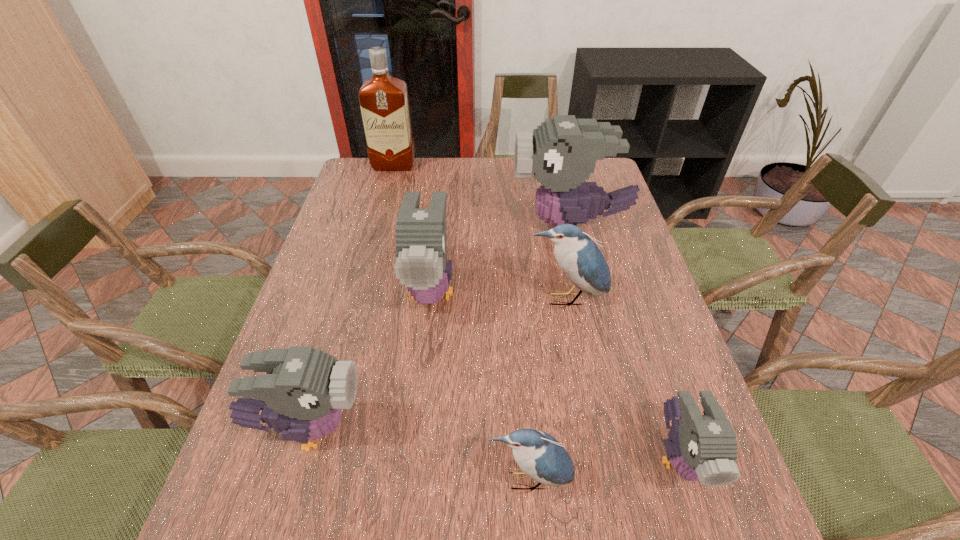
Identify the location of the smallest gray bird. The width and height of the screenshot is (960, 540). (703, 448).

At what (x,y) coordinates should I click in order to perform the action: click on vacant space situated 0.250m on the front label of the tallest object. Please return your answer as a coordinate pair (x, y). The image size is (960, 540). Looking at the image, I should click on 381,214.

I want to click on vacant area situated at the beak of the farthest gray bird, so click(x=427, y=227).

What are the coordinates of `vacant space located at the beak of the farthest gray bird` in the screenshot? It's located at (450, 227).

The image size is (960, 540). What are the coordinates of `vacant area located at the beak of the farthest gray bird` in the screenshot? It's located at point(412,227).

The width and height of the screenshot is (960, 540). Find the location of `free space located at the beak of the fifth object from right to left`. free space located at the beak of the fifth object from right to left is located at coordinates (406, 515).

Identify the location of free spot located 0.310m at the tip of the farther blue bird's beak. pyautogui.click(x=590, y=427).

Identify the location of vacant area situated 0.140m at the beak of the second smallest gray bird. (437, 430).

The image size is (960, 540). Identify the location of free location located at the tip of the nearer blue bird's beak. (533, 530).

You are a GUI agent. You are given a task and a screenshot of the screen. Output one action in this format:
    pyautogui.click(x=<x>, y=<y>)
    Task: Click on the vacant space situated 0.050m at the beak of the smallest gray bird
    Image resolution: width=960 pixels, height=540 pixels.
    Given the screenshot: What is the action you would take?
    pyautogui.click(x=706, y=539)